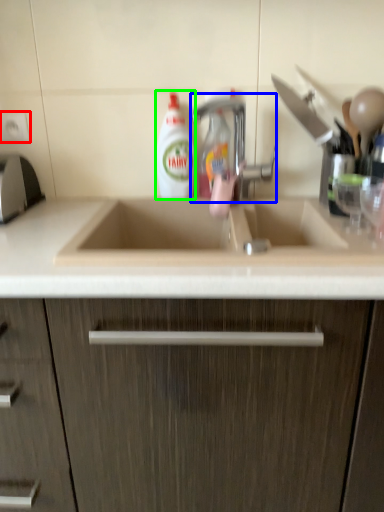
Question: Which object is positioned closest to electric outlet (highlighted by a red box)? Select from tap (highlighted by a blue box) and cleaning product (highlighted by a green box).

Choices:
 (A) tap
 (B) cleaning product

Answer: (B)